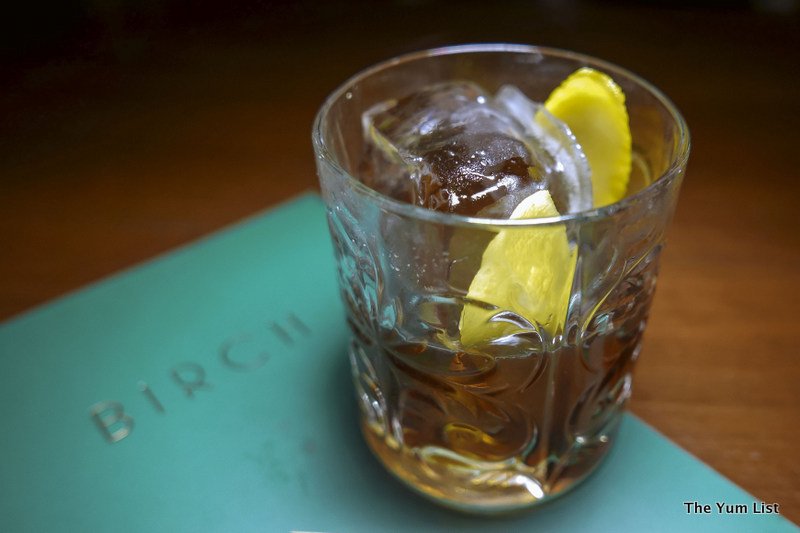
At what (x,y) coordinates should I click in order to perform the action: click on table. Please return your answer as a coordinate pair (x, y). Looking at the image, I should click on pyautogui.click(x=42, y=209).